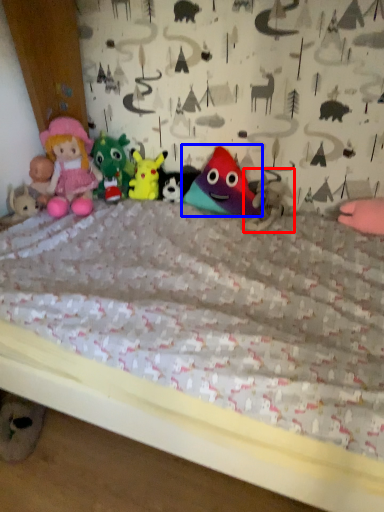
Question: Which object is closer to the camera taking this photo, toy (highlighted by a red box) or toy (highlighted by a blue box)?

Choices:
 (A) toy
 (B) toy

Answer: (A)